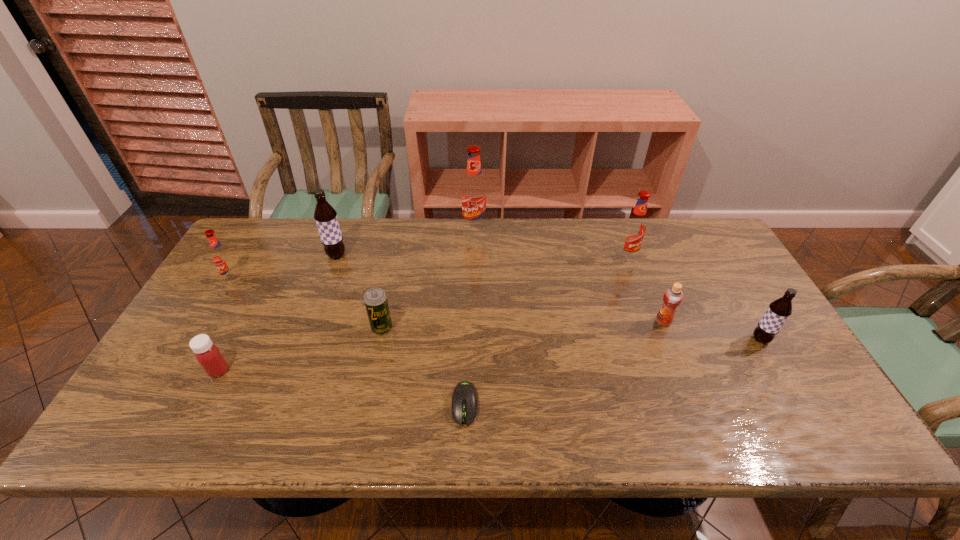
This screenshot has height=540, width=960. Identify the location of free region that satisfies the following two spatial constraints: 1. on the back side of the medicine; 2. on the right side of the orange juice. (244, 321).

You are a GUI agent. You are given a task and a screenshot of the screen. Output one action in this format:
    pyautogui.click(x=<x>, y=<y>)
    Task: Click on the free region that satisfies the following two spatial constraints: 1. on the front side of the smaller brown root beer; 2. on the left side of the orange juice
    
    Given the screenshot: What is the action you would take?
    pyautogui.click(x=670, y=340)

Where is `vacant space that satisfies the following two spatial constraints: 1. on the front side of the seventh object from right to left; 2. on the right side of the orange juice`? The image size is (960, 540). vacant space that satisfies the following two spatial constraints: 1. on the front side of the seventh object from right to left; 2. on the right side of the orange juice is located at coordinates (312, 321).

Image resolution: width=960 pixels, height=540 pixels. What are the coordinates of `blank space that satisfies the following two spatial constraints: 1. on the front side of the farthest object; 2. on the right side of the orange juice` in the screenshot? It's located at (473, 321).